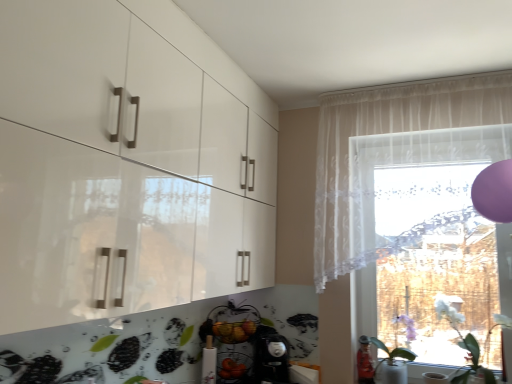
Question: Does sheer white curtain at upper right contain white glossy vase at lower right, arranged as the 1th plant when viewed from the left?

Choices:
 (A) yes
 (B) no

Answer: (B)

Question: Are sheer white curtain at upper right and white glossy vase at lower right, which ranks as the 2th plant in right-to-left order, far apart?

Choices:
 (A) no
 (B) yes

Answer: (A)

Question: Would you say sheer white curtain at upper right is outside white glossy vase at lower right, which ranks as the 2th plant in right-to-left order?

Choices:
 (A) yes
 (B) no

Answer: (A)

Question: Does sheer white curtain at upper right turn towards white glossy vase at lower right, arranged as the 1th plant when viewed from the left?

Choices:
 (A) no
 (B) yes

Answer: (A)

Question: From the image's perspective, is sheer white curtain at upper right on white glossy vase at lower right, arranged as the 1th plant when viewed from the left?

Choices:
 (A) yes
 (B) no

Answer: (A)

Question: Is sheer white curtain at upper right further to the viewer compared to white glossy vase at lower right, arranged as the 1th plant when viewed from the left?

Choices:
 (A) yes
 (B) no

Answer: (B)

Question: From the image's perspective, is white glossy vase at lower right, arranged as the 1th plant when viewed from the left, below transparent lace curtain at right?

Choices:
 (A) yes
 (B) no

Answer: (A)

Question: Is white glossy vase at lower right, which ranks as the 2th plant in right-to-left order, shorter than transparent lace curtain at right?

Choices:
 (A) no
 (B) yes

Answer: (B)

Question: Does white glossy vase at lower right, which ranks as the 2th plant in right-to-left order, have a larger size compared to transparent lace curtain at right?

Choices:
 (A) no
 (B) yes

Answer: (A)

Question: From the image's perspective, is white glossy vase at lower right, arranged as the 1th plant when viewed from the left, above transparent lace curtain at right?

Choices:
 (A) no
 (B) yes

Answer: (A)

Question: Is white glossy vase at lower right, which ranks as the 2th plant in right-to-left order, placed right next to transparent lace curtain at right?

Choices:
 (A) yes
 (B) no

Answer: (B)

Question: Does white glossy vase at lower right, which ranks as the 2th plant in right-to-left order, appear on the right side of transparent lace curtain at right?

Choices:
 (A) no
 (B) yes

Answer: (A)

Question: From a real-world perspective, is sheer white curtain at upper right beneath white matte plant at lower right, which ranks as the second plant in left-to-right order?

Choices:
 (A) yes
 (B) no

Answer: (B)